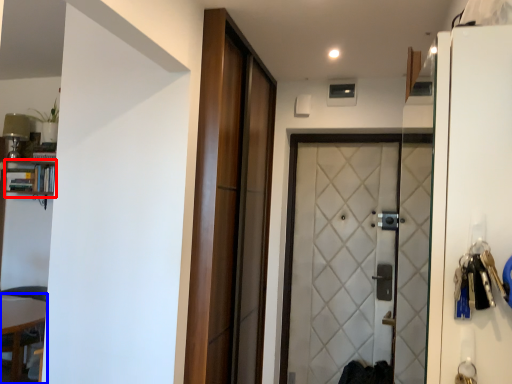
Question: Among these objects, which one is nearest to the camera, bookshelf (highlighted by a red box) or table (highlighted by a blue box)?

Choices:
 (A) bookshelf
 (B) table

Answer: (B)